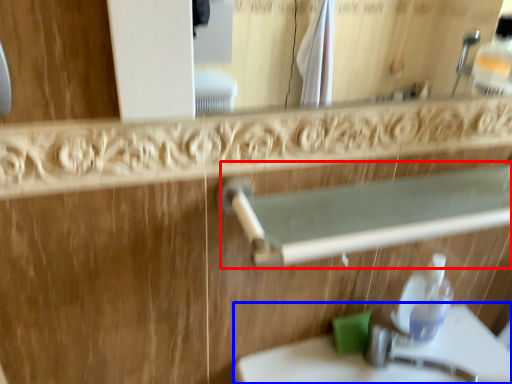
Question: Which object appears farthest to the camera in this image, balustrade (highlighted by a red box) or sink (highlighted by a blue box)?

Choices:
 (A) balustrade
 (B) sink

Answer: (B)